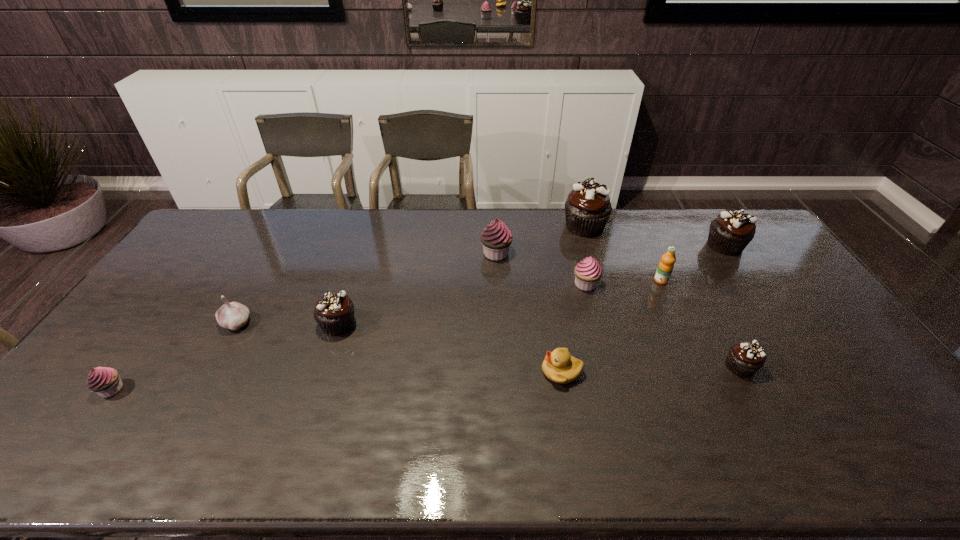
Find the location of a particular element. free space located on the front of the rightmost cupcake is located at coordinates (748, 280).

The image size is (960, 540). In order to click on vacant space located 0.330m on the right of the second pink cupcake from right to left in this screenshot , I will do `click(606, 253)`.

Where is `free location located 0.300m on the label of the third object from right to left`? free location located 0.300m on the label of the third object from right to left is located at coordinates (697, 360).

Image resolution: width=960 pixels, height=540 pixels. Find the location of `vacant region located 0.370m on the back of the fifth farthest cupcake`. vacant region located 0.370m on the back of the fifth farthest cupcake is located at coordinates (366, 237).

Identify the location of blank space located 0.270m on the back of the second smallest pink cupcake. (571, 228).

Find the location of a particular element. The height and width of the screenshot is (540, 960). free space located 0.070m on the right of the ninth object from right to left is located at coordinates (276, 323).

Locate an element on the screen. Image resolution: width=960 pixels, height=540 pixels. vacant space situated on the front of the second brown cupcake from right to left is located at coordinates (781, 446).

This screenshot has width=960, height=540. Identify the location of vacant area located 0.100m on the right of the smallest pink cupcake. (163, 389).

Where is `vacant space located on the front-facing side of the duckling`? vacant space located on the front-facing side of the duckling is located at coordinates (478, 372).

You are a GUI agent. You are given a task and a screenshot of the screen. Output one action in this format:
    pyautogui.click(x=<x>, y=<y>)
    Task: Click on the free space located on the front-facing side of the duckling
    This screenshot has height=540, width=960.
    Given the screenshot: What is the action you would take?
    pyautogui.click(x=523, y=372)